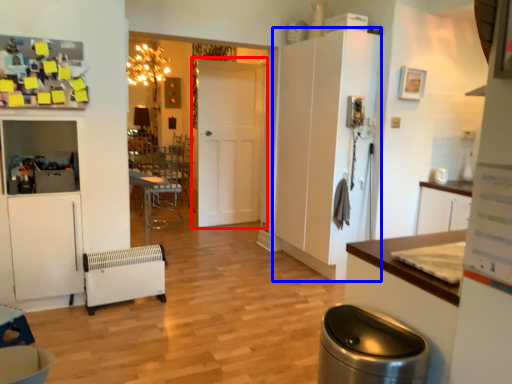
Question: Which point is closer to the camera, door (highlighted by a red box) or cabinetry (highlighted by a blue box)?

Choices:
 (A) door
 (B) cabinetry

Answer: (B)